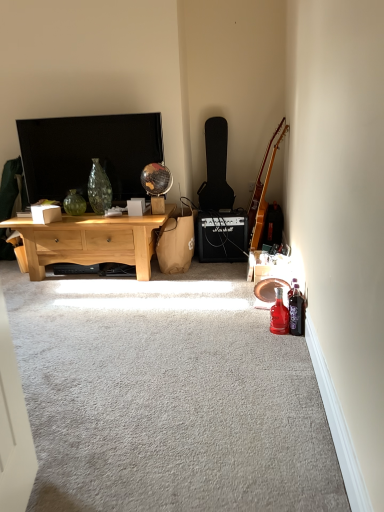
Where is `vacant area that lies between metallic silver mechanical fan at lower right and brown paper bag at center`? The height and width of the screenshot is (512, 384). vacant area that lies between metallic silver mechanical fan at lower right and brown paper bag at center is located at coordinates (222, 278).